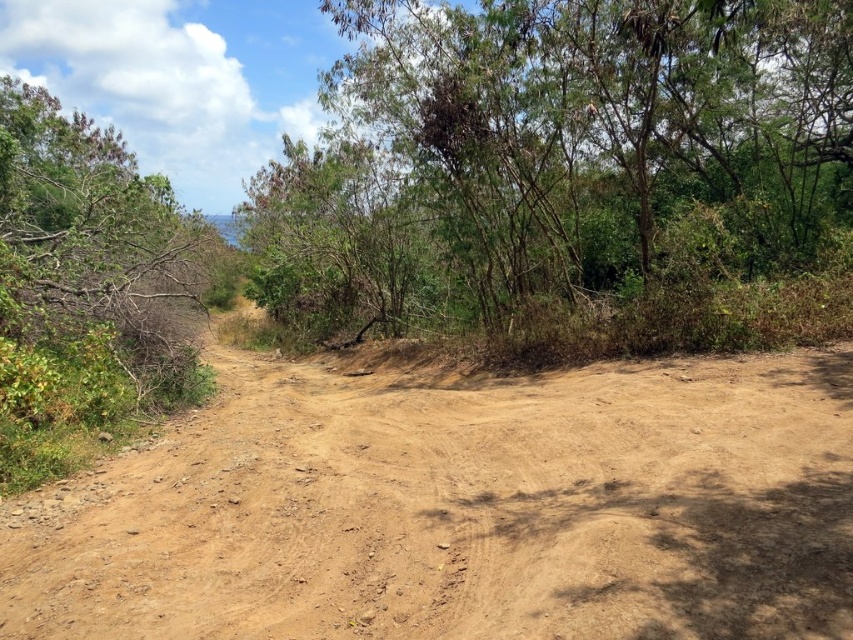
Question: Which point is farther to the camera?

Choices:
 (A) 534,52
 (B) 769,618

Answer: (A)

Question: Can you confirm if brown sandy dirt at center is thinner than green leafy tree at upper center?

Choices:
 (A) no
 (B) yes

Answer: (B)

Question: Is brown sandy dirt at center above green leafy tree at upper center?

Choices:
 (A) no
 (B) yes

Answer: (A)

Question: Which point appears closest to the camera in this image?

Choices:
 (A) (746, 56)
 (B) (772, 412)

Answer: (B)

Question: Which point is farther to the camera?

Choices:
 (A) (715, 362)
 (B) (635, 220)

Answer: (B)

Question: Does brown sandy dirt at center appear on the left side of green leafy tree at upper center?

Choices:
 (A) no
 (B) yes

Answer: (A)